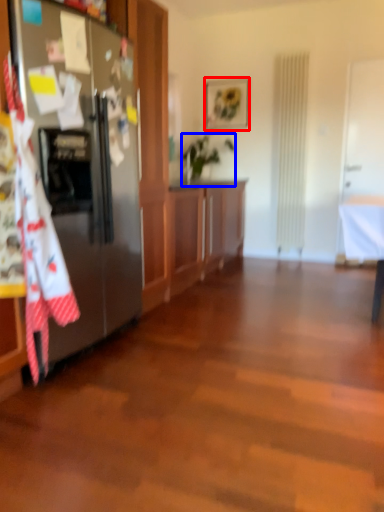
Question: Which point is further to the camera, picture frame (highlighted by a red box) or houseplant (highlighted by a blue box)?

Choices:
 (A) picture frame
 (B) houseplant

Answer: (A)